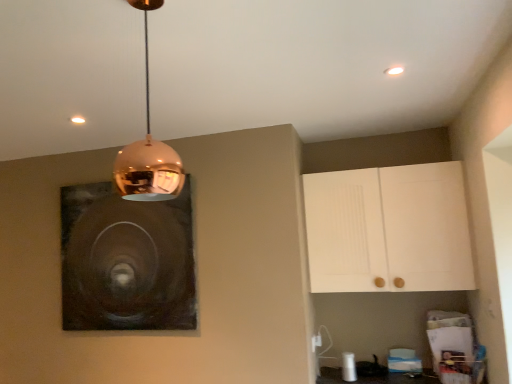
Question: From the image's perspective, relative to white matte cabinet at upper right, is copper reflective pendant light at upper center above or below?

Choices:
 (A) above
 (B) below

Answer: (A)

Question: Is copper reflective pendant light at upper center wider or thinner than white matte cabinet at upper right?

Choices:
 (A) thin
 (B) wide

Answer: (A)

Question: Which is farther from the white matte cabinet at upper right?

Choices:
 (A) dark matte painting at upper left
 (B) copper reflective pendant light at upper center

Answer: (B)

Question: Considering the real-world distances, which object is farthest from the copper reflective pendant light at upper center?

Choices:
 (A) white matte cabinet at upper right
 (B) dark matte painting at upper left

Answer: (A)